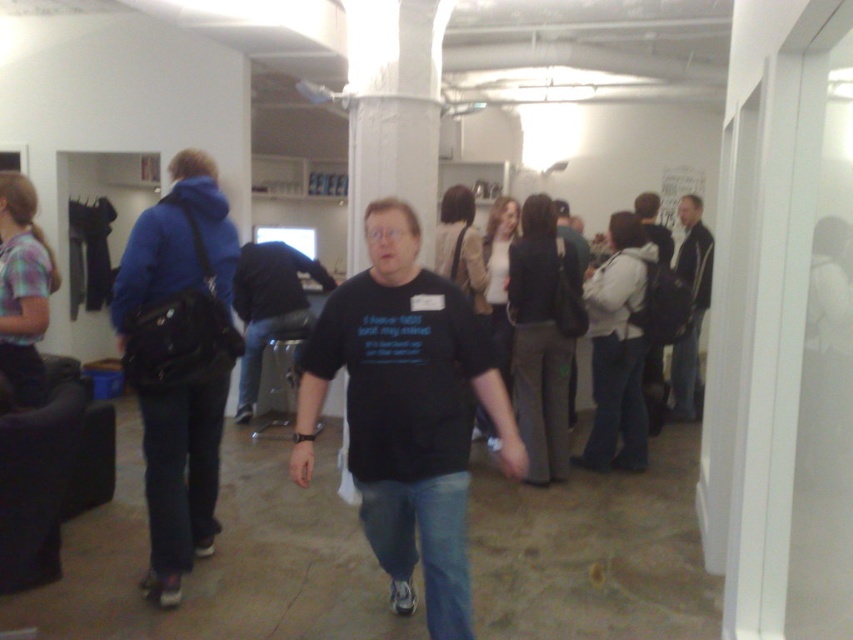
Which is behind, point (403, 365) or point (287, 296)?

The point (287, 296) is behind.

From the picture: Who is taller, black matte t-shirt at center or black matte shirt at center?

black matte t-shirt at center

At what (x,y) coordinates should I click in order to perform the action: click on black matte t-shirt at center. Please return your answer as a coordinate pair (x, y). Image resolution: width=853 pixels, height=640 pixels. Looking at the image, I should click on (407, 412).

Does black matte shirt at center appear on the left side of black leather jacket at right?

Correct, you'll find black matte shirt at center to the left of black leather jacket at right.

Describe the element at coordinates (270, 307) in the screenshot. The height and width of the screenshot is (640, 853). I see `black matte shirt at center` at that location.

Image resolution: width=853 pixels, height=640 pixels. I want to click on black matte shirt at center, so click(x=270, y=307).

Is black matte t-shirt at center shorter than black leather jacket at right?

Correct, black matte t-shirt at center is not as tall as black leather jacket at right.

Who is more forward, (x=369, y=481) or (x=698, y=196)?

Point (x=369, y=481)

Which is in front, point (398, 228) or point (693, 275)?

Positioned in front is point (398, 228).

This screenshot has height=640, width=853. Find the location of `black matte t-shirt at center`. black matte t-shirt at center is located at coordinates [407, 412].